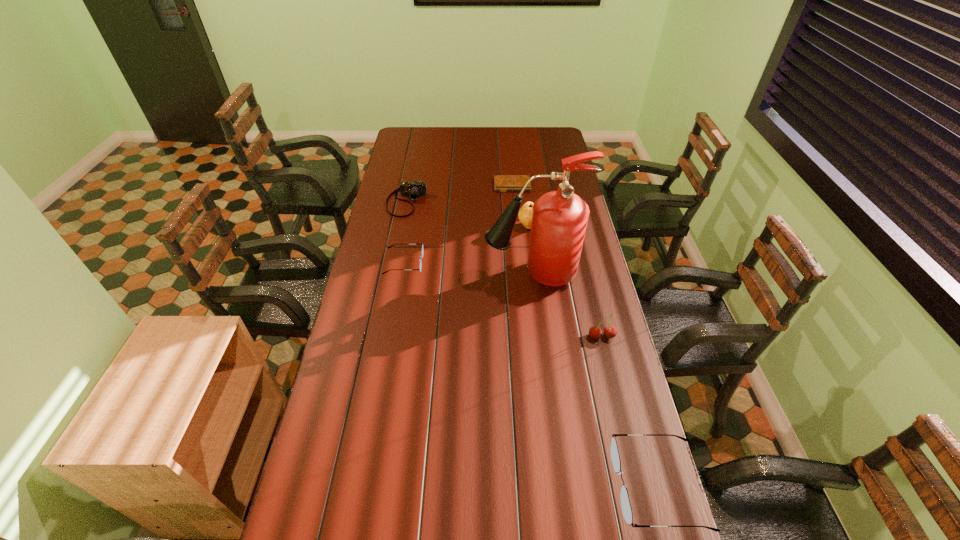
Image resolution: width=960 pixels, height=540 pixels. Find the location of `free space for an extra spectacles to achieve even spacing`. free space for an extra spectacles to achieve even spacing is located at coordinates (505, 352).